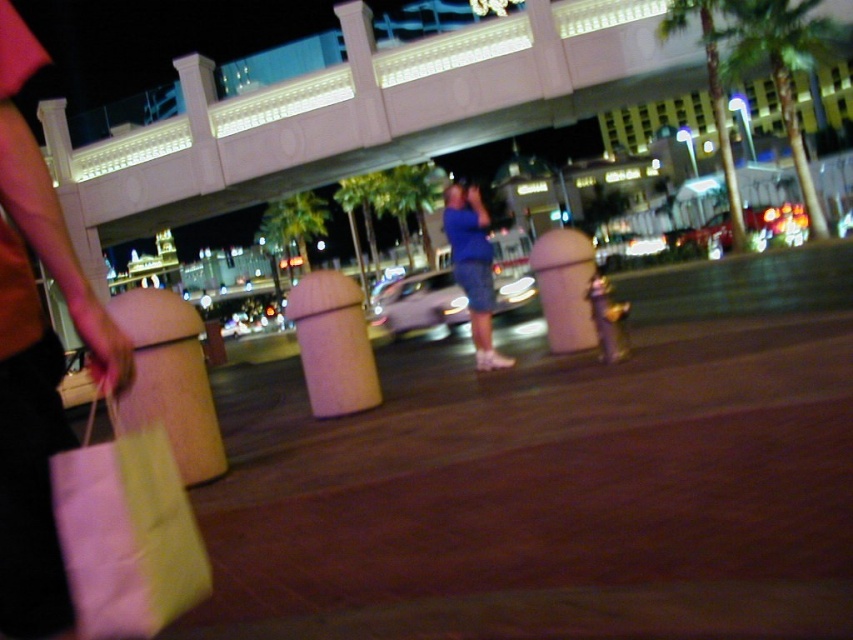
Question: Does brown smooth pavement at center have a smaller size compared to pink matte trash can at center?

Choices:
 (A) yes
 (B) no

Answer: (A)

Question: Which object is the closest to the brown smooth pavement at center?

Choices:
 (A) matte yellow paper bag at lower left
 (B) pink matte trash can at center

Answer: (A)

Question: Does brown smooth pavement at center have a greater width compared to blue fabric dress at center?

Choices:
 (A) yes
 (B) no

Answer: (A)

Question: Which point appears farthest from the camera in this image?

Choices:
 (A) (555, 230)
 (B) (717, 356)
 (C) (376, 394)

Answer: (A)

Question: Does matte plastic trash can at center appear over blue fabric dress at center?

Choices:
 (A) yes
 (B) no

Answer: (A)

Question: Which point is farther to the camera?

Choices:
 (A) matte yellow paper bag at lower left
 (B) brown smooth pavement at center
 (C) pink matte trash can at center
 (D) blue fabric dress at center

Answer: (D)